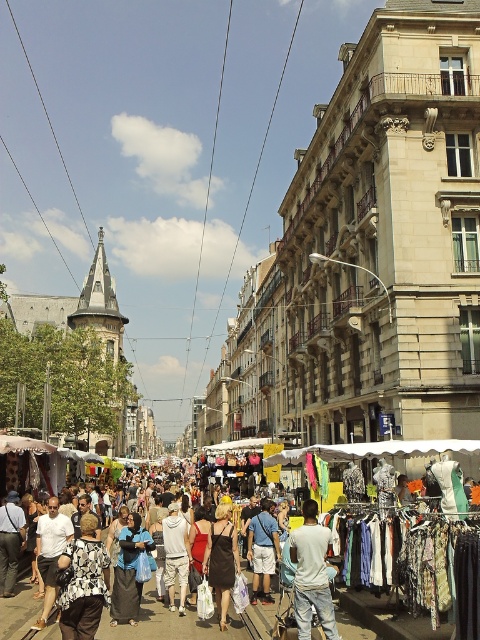
You are standing at the point marked as point (x=82, y=552) in this European street market scene. A trolleybus is approaching along the avenue. If the trolleybus travels at an average speed of 15 km per hour, how many minutes will it take for the trolleybus to reach you?

The trolleybus is 51.79 meters away from you at point (x=82, y=552). Converting the speed to meters per minute, 15 km per hour equals 250 meters per minute. Dividing the distance by speed gives 51.79 divided by 250, which is approximately 0.207 minutes, so about 12.4 seconds. Therefore, the trolleybus will reach you in roughly 12 seconds.

You are a customer at this European street market and you see the white cotton shirt at center. If you want to buy it, which direction should you walk from your current position at point 0.000, 0.000 to reach it?

The white cotton shirt at center is located at point (x=312, y=573), so you should walk northeast to reach it.

You are a customer in this European street market and you want to buy the black fabric dress at center. Where exactly should you look to find it?

The black fabric dress at center is located at point 0.875 on the x axis and 0.463 on the y axis.